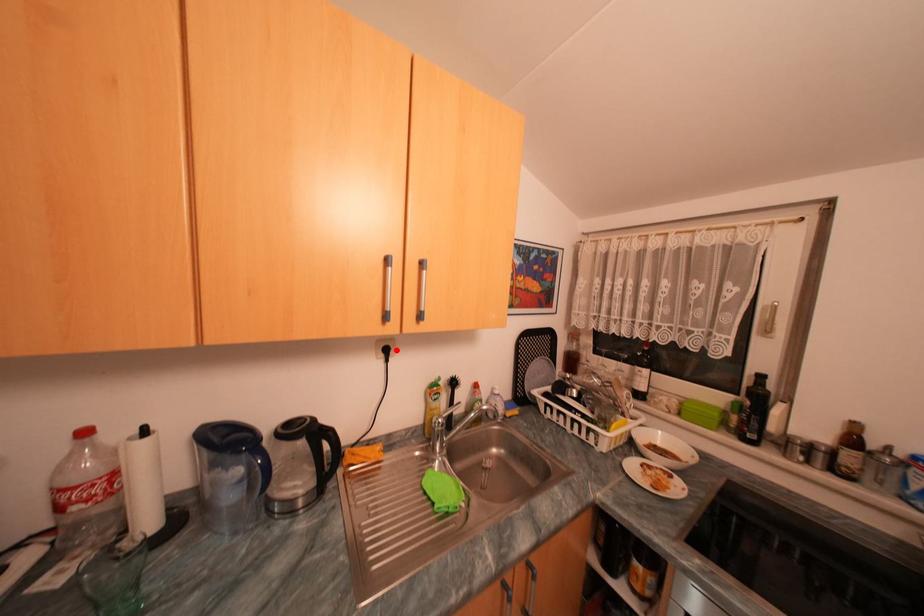
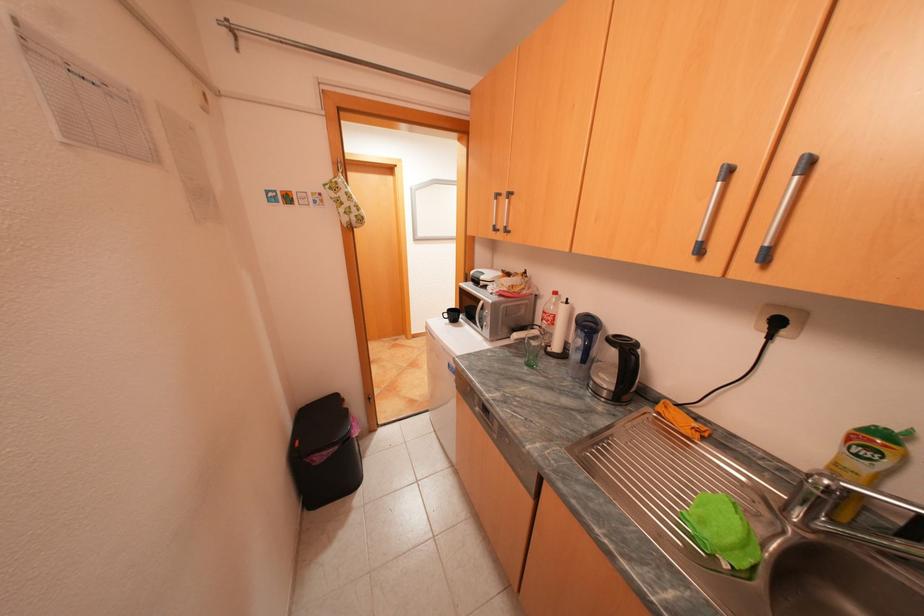
Locate, in the second image, the point that corresponds to the highlighted location in the first image.

(786, 323)